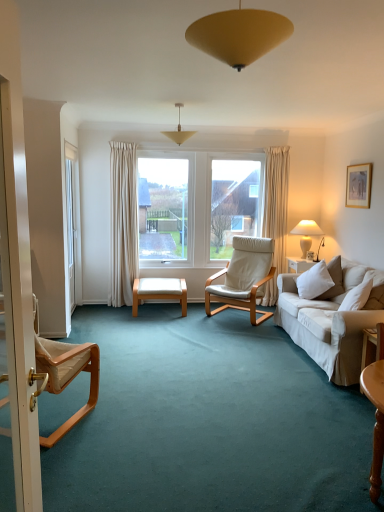
Describe the element at coordinates (314, 281) in the screenshot. I see `white soft cushion at right` at that location.

The width and height of the screenshot is (384, 512). What do you see at coordinates (72, 222) in the screenshot?
I see `white glass screen door at left, which is the first screen door in back-to-front order` at bounding box center [72, 222].

The width and height of the screenshot is (384, 512). I want to click on light brown wood chair at left, the 2th chair in the right-to-left sequence, so click(66, 373).

The width and height of the screenshot is (384, 512). What are the coordinates of `white ceramic lamp at right, acting as the 3th lamp starting from the left` in the screenshot? It's located at (306, 234).

This screenshot has height=512, width=384. Describe the element at coordinates (178, 131) in the screenshot. I see `matte yellow pendant light at upper center, the third lamp positioned from the right` at that location.

Identify the location of wooden picture frame at upper right. The image size is (384, 512). (358, 185).

Which object is positioned more to the right, white leather chair at center, the first chair when ordered from back to front, or matte yellow pendant light at upper center, arranged as the second lamp when viewed from the front?

From the viewer's perspective, white leather chair at center, the first chair when ordered from back to front, appears more on the right side.

Is white leather chair at center, the first chair when ordered from back to front, located outside matte yellow pendant light at upper center, the third lamp positioned from the right?

white leather chair at center, the first chair when ordered from back to front, lies outside matte yellow pendant light at upper center, the third lamp positioned from the right,'s area.

From their relative heights in the image, would you say white leather chair at center, which is the 1th chair from right to left, is taller or shorter than matte yellow pendant light at upper center, the 2th lamp viewed from the back?

Considering their sizes, white leather chair at center, which is the 1th chair from right to left, has more height than matte yellow pendant light at upper center, the 2th lamp viewed from the back.

From the image's perspective, who appears lower, white leather chair at center, the second chair when ordered from left to right, or matte yellow pendant light at upper center, the 1th lamp viewed from the top?

white leather chair at center, the second chair when ordered from left to right, from the image's perspective.

From a real-world perspective, relative to white glass screen door at left, marked as the 1th screen door in a left-to-right arrangement, is matte yellow pendant light at upper center, the third lamp positioned from the right, vertically above or below?

Clearly, from a real-world perspective, matte yellow pendant light at upper center, the third lamp positioned from the right, is above white glass screen door at left, marked as the 1th screen door in a left-to-right arrangement.

Locate an element on the screen. This screenshot has width=384, height=512. the 1st lamp in front when counting from the white glass screen door at left, which is the first screen door in back-to-front order is located at coordinates (178, 131).

Do you think matte yellow pendant light at upper center, which is the first lamp in left-to-right order, is within white glass screen door at left, which appears as the 2th screen door when viewed from the front, or outside of it?

matte yellow pendant light at upper center, which is the first lamp in left-to-right order, cannot be found inside white glass screen door at left, which appears as the 2th screen door when viewed from the front.

Looking at this image, from the image's perspective, is matte yellow pendant light at upper center, which is the first lamp in left-to-right order, above or below white glass screen door at left, the 2th screen door from the right?

Clearly, from the image's perspective, matte yellow pendant light at upper center, which is the first lamp in left-to-right order, is above white glass screen door at left, the 2th screen door from the right.

Between matte white screen door at left, placed as the first screen door when sorted from right to left, and light brown wood chair at left, which appears as the second chair when viewed from the back, which one has more height?

Standing taller between the two is matte white screen door at left, placed as the first screen door when sorted from right to left.

From a real-world perspective, between matte white screen door at left, the second screen door from the back, and light brown wood chair at left, the 2th chair in the right-to-left sequence, who is vertically lower?

light brown wood chair at left, the 2th chair in the right-to-left sequence, is physically lower.

In the scene shown: Who is smaller, matte white screen door at left, which appears as the 2th screen door when viewed from the left, or light brown wood chair at left, which appears as the 1th chair when viewed from the left?

matte white screen door at left, which appears as the 2th screen door when viewed from the left.

How different are the orientations of matte white screen door at left, which is counted as the first screen door, starting from the front, and light brown wood chair at left, which appears as the second chair when viewed from the back, in degrees?

The angle between the facing direction of matte white screen door at left, which is counted as the first screen door, starting from the front, and the facing direction of light brown wood chair at left, which appears as the second chair when viewed from the back, is 66.3 degrees.

Considering the sizes of light brown wood chair at left, which appears as the 1th chair when viewed from the left, and light wood ottoman at center in the image, is light brown wood chair at left, which appears as the 1th chair when viewed from the left, taller or shorter than light wood ottoman at center?

light brown wood chair at left, which appears as the 1th chair when viewed from the left, is taller than light wood ottoman at center.

Consider the image. Considering the positions of objects light brown wood chair at left, which appears as the second chair when viewed from the back, and light wood ottoman at center in the image provided, who is in front, light brown wood chair at left, which appears as the second chair when viewed from the back, or light wood ottoman at center?

light brown wood chair at left, which appears as the second chair when viewed from the back, is more forward.

In terms of width, does light brown wood chair at left, the 2th chair in the right-to-left sequence, look wider or thinner when compared to light wood ottoman at center?

Considering their sizes, light brown wood chair at left, the 2th chair in the right-to-left sequence, looks broader than light wood ottoman at center.

In the scene shown: Between wooden picture frame at upper right and white ceramic lamp at right, which is the first lamp from back to front, which one appears on the left side from the viewer's perspective?

white ceramic lamp at right, which is the first lamp from back to front, is more to the left.

Is wooden picture frame at upper right far from white ceramic lamp at right, acting as the 3th lamp starting from the left?

Actually, wooden picture frame at upper right and white ceramic lamp at right, acting as the 3th lamp starting from the left, are a little close together.

Where is `picture frame positioned vertically above the white ceramic lamp at right, the third lamp in the top-to-bottom sequence (from a real-world perspective)`? Image resolution: width=384 pixels, height=512 pixels. picture frame positioned vertically above the white ceramic lamp at right, the third lamp in the top-to-bottom sequence (from a real-world perspective) is located at coordinates (358, 185).

Based on the photo, from the image's perspective, which one is positioned higher, matte yellow pendant light at upper center, which is the first lamp in left-to-right order, or matte white screen door at left, which is counted as the first screen door, starting from the front?

matte yellow pendant light at upper center, which is the first lamp in left-to-right order, is shown above in the image.

How different are the orientations of matte yellow pendant light at upper center, the 1th lamp viewed from the top, and matte white screen door at left, placed as the first screen door when sorted from right to left, in degrees?

The facing directions of matte yellow pendant light at upper center, the 1th lamp viewed from the top, and matte white screen door at left, placed as the first screen door when sorted from right to left, are 79.2 degrees apart.

Is matte yellow pendant light at upper center, the 2th lamp viewed from the back, not inside matte white screen door at left, placed as the first screen door when sorted from right to left?

Absolutely, matte yellow pendant light at upper center, the 2th lamp viewed from the back, is external to matte white screen door at left, placed as the first screen door when sorted from right to left.

Locate an element on the screen. This screenshot has height=512, width=384. the 1st lamp counting from the right of the matte white screen door at left, which is counted as the first screen door, starting from the front is located at coordinates (178, 131).

Is matte white screen door at left, placed as the first screen door when sorted from right to left, looking in the opposite direction of wooden picture frame at upper right?

No, matte white screen door at left, placed as the first screen door when sorted from right to left,'s orientation is not away from wooden picture frame at upper right.

From the picture: Which of these two, matte white screen door at left, which appears as the 2th screen door when viewed from the left, or wooden picture frame at upper right, is smaller?

With smaller size is wooden picture frame at upper right.

In the image, is matte white screen door at left, which appears as the 2th screen door when viewed from the left, positioned in front of or behind wooden picture frame at upper right?

Clearly, matte white screen door at left, which appears as the 2th screen door when viewed from the left, is in front of wooden picture frame at upper right.

Does matte white screen door at left, placed as the first screen door when sorted from right to left, have a greater width compared to wooden picture frame at upper right?

Indeed, matte white screen door at left, placed as the first screen door when sorted from right to left, has a greater width compared to wooden picture frame at upper right.

Find the location of a particular element. The image size is (384, 512). lamp that is the 2nd object to the left of the white leather chair at center, which is counted as the second chair, starting from the front, starting at the anchor is located at coordinates (178, 131).

From the image's perspective, count 1st screen doors downward from the matte yellow pendant light at upper center, the third lamp in the bottom-to-top sequence, and point to it. Please provide its 2D coordinates.

[(72, 222)]

Looking at the image, which one is located further to white ceramic lamp at right, placed as the first lamp when sorted from bottom to top, white glass screen door at left, which appears as the 2th screen door when viewed from the front, or white leather chair at center, the second chair when ordered from left to right?

white glass screen door at left, which appears as the 2th screen door when viewed from the front, is positioned further to the anchor white ceramic lamp at right, placed as the first lamp when sorted from bottom to top.

Looking at the image, which one is located further to white ceramic lamp at right, which is the first lamp from back to front, light wood ottoman at center or white leather chair at center, the first chair when ordered from back to front?

The object further to white ceramic lamp at right, which is the first lamp from back to front, is light wood ottoman at center.

Considering their positions, is wooden picture frame at upper right positioned closer to white leather chair at center, which is counted as the second chair, starting from the front, than matte white screen door at left, placed as the first screen door when sorted from right to left?

wooden picture frame at upper right.

From the image, which object appears to be farther from white soft cushion at right, matte yellow pendant light at upper center, the 2th lamp viewed from the back, or white glass screen door at left, which appears as the 2th screen door when viewed from the front?

white glass screen door at left, which appears as the 2th screen door when viewed from the front, lies further to white soft cushion at right than the other object.

Considering their positions, is light brown wood chair at left, the first chair from the front, positioned closer to matte yellow pendant light at upper center, the third lamp positioned from the right, than white glass screen door at left, the 2th screen door from the right?

white glass screen door at left, the 2th screen door from the right, lies closer to matte yellow pendant light at upper center, the third lamp positioned from the right, than the other object.

From the image, which object appears to be nearer to white glass screen door at left, which appears as the 2th screen door when viewed from the front, matte yellow pendant light at upper center, the 2th lamp viewed from the back, or wooden picture frame at upper right?

matte yellow pendant light at upper center, the 2th lamp viewed from the back.

Considering their positions, is white soft cushion at right positioned closer to matte yellow pendant light at upper center, which is the first lamp in left-to-right order, than matte white screen door at left, placed as the first screen door when sorted from right to left?

Based on the image, white soft cushion at right appears to be nearer to matte yellow pendant light at upper center, which is the first lamp in left-to-right order.

Estimate the real-world distances between objects in this image. Which object is closer to white ceramic lamp at right, the 1th lamp in the right-to-left sequence, wooden picture frame at upper right or matte yellow cone at upper center, which is counted as the 2th lamp, starting from the right?

wooden picture frame at upper right is closer to white ceramic lamp at right, the 1th lamp in the right-to-left sequence.

What are the coordinates of `screen door located between matte white screen door at left, which is counted as the first screen door, starting from the front, and light wood ottoman at center in the depth direction` in the screenshot? It's located at [72, 222].

You are a GUI agent. You are given a task and a screenshot of the screen. Output one action in this format:
    pyautogui.click(x=<x>, y=<y>)
    Task: Click on the lamp between light brown wood chair at left, which appears as the second chair when viewed from the back, and white ceramic lamp at right, which appears as the third lamp when viewed from the front, in the front-back direction
    
    Given the screenshot: What is the action you would take?
    pyautogui.click(x=178, y=131)

I want to click on lamp between matte yellow cone at upper center, which is counted as the 2th lamp, starting from the left, and light wood ottoman at center from front to back, so click(x=178, y=131).

The image size is (384, 512). What are the coordinates of `pillow between matte white screen door at left, which appears as the 2th screen door when viewed from the left, and wooden picture frame at upper right from front to back` in the screenshot? It's located at (314, 281).